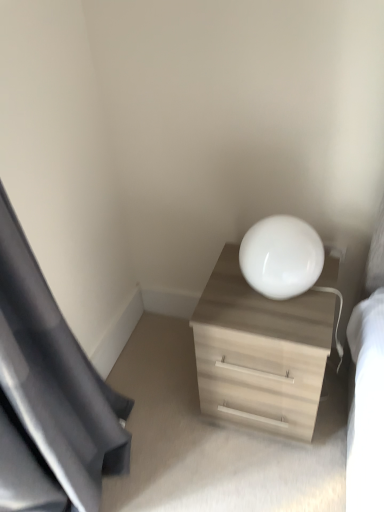
Where is `free point behind black fabric curtain at left`? free point behind black fabric curtain at left is located at coordinates (147, 370).